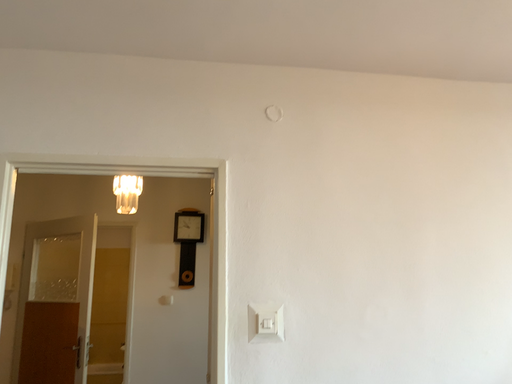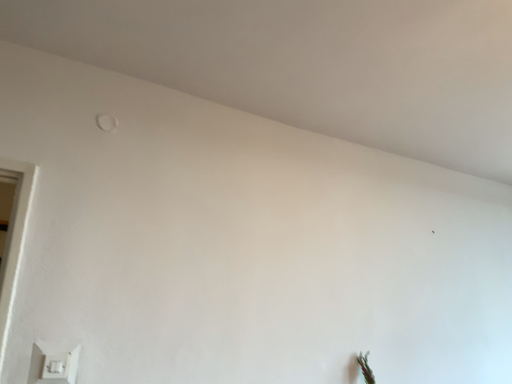
Question: Which way did the camera rotate in the video?

Choices:
 (A) rotated right
 (B) rotated left

Answer: (A)